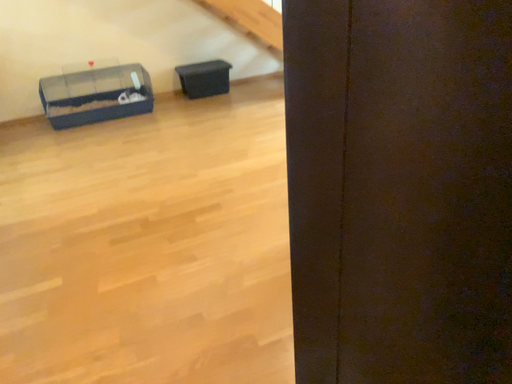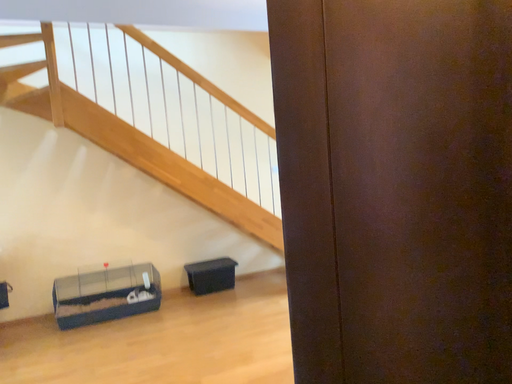
Question: Which way did the camera rotate in the video?

Choices:
 (A) rotated upward
 (B) rotated downward

Answer: (A)